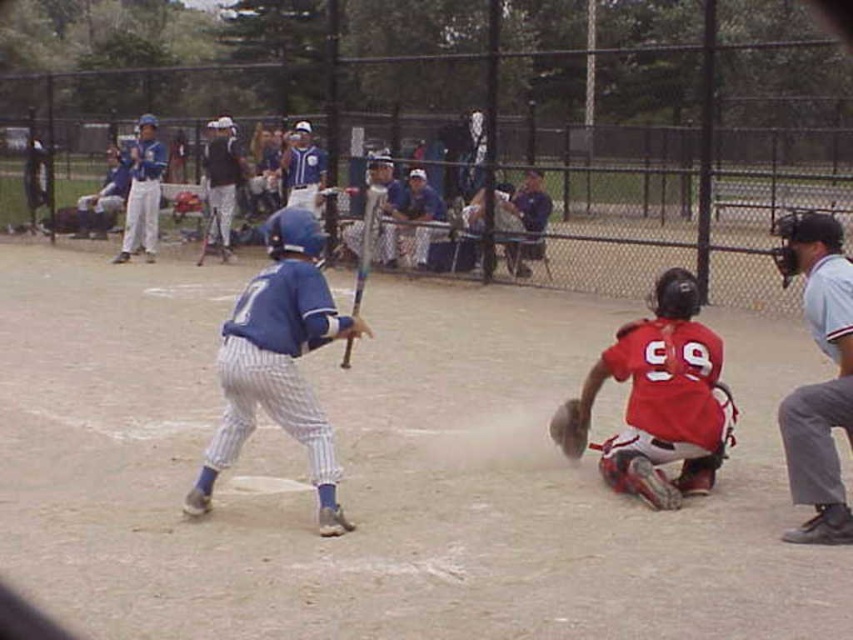
Does point (134, 241) lie in front of point (575, 435)?

No.

Which is behind, point (141, 198) or point (564, 440)?

The point (141, 198) is more distant.

Find the location of a particular element. The height and width of the screenshot is (640, 853). matte blue helmet at upper left is located at coordinates (143, 193).

Can you confirm if white pinstriped uniform at upper center is positioned below metallic silver bat at center?

Actually, white pinstriped uniform at upper center is above metallic silver bat at center.

Can you confirm if white pinstriped uniform at upper center is wider than metallic silver bat at center?

Yes.

Locate an element on the screen. This screenshot has width=853, height=640. white pinstriped uniform at upper center is located at coordinates (485, 220).

Does red matte jersey at lower right come behind gray fabric umpire at right?

Yes.

Identify the location of red matte jersey at lower right. (659, 400).